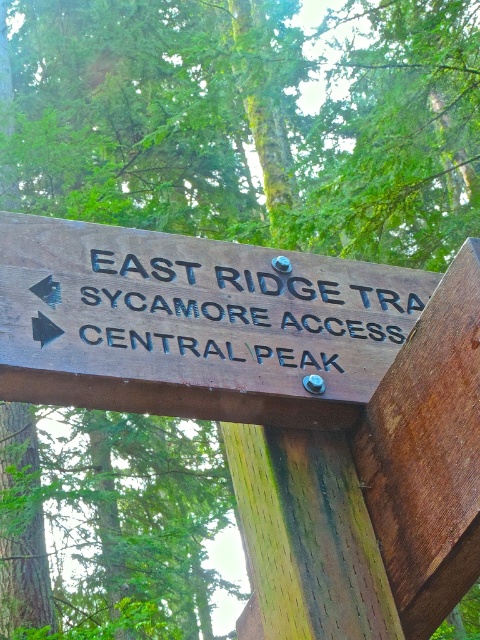
You are standing in front of the wooden directional sign in the forest. There are two points marked on the sign at coordinates point (203,380) and point (206,284). Which point is closer to you?

Point (203,380) is closer to the viewer than point (206,284).

You are a hiker trying to read the signs in the forest. You see the brown wooden sign at center and the black wood sign at center. Which one do you think is larger?

The brown wooden sign at center is bigger than the black wood sign at center, so the brown wooden sign at center is larger.

You are standing in front of two signs in the forest. You see the brown wooden sign at center and the black wood sign at center. Which one is positioned to the left?

The brown wooden sign at center is positioned to the left of the black wood sign at center.